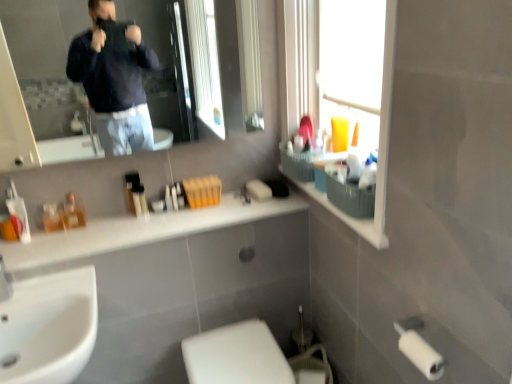
Locate an element on the screen. The image size is (512, 384). free location to the left of translucent glass perfume at center, the 2th toiletry viewed from the right is located at coordinates (37, 235).